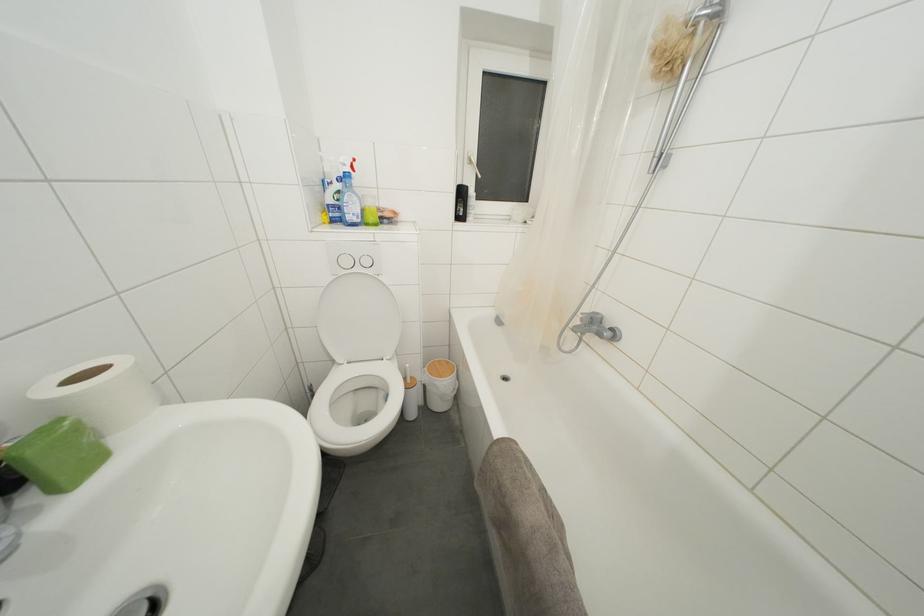
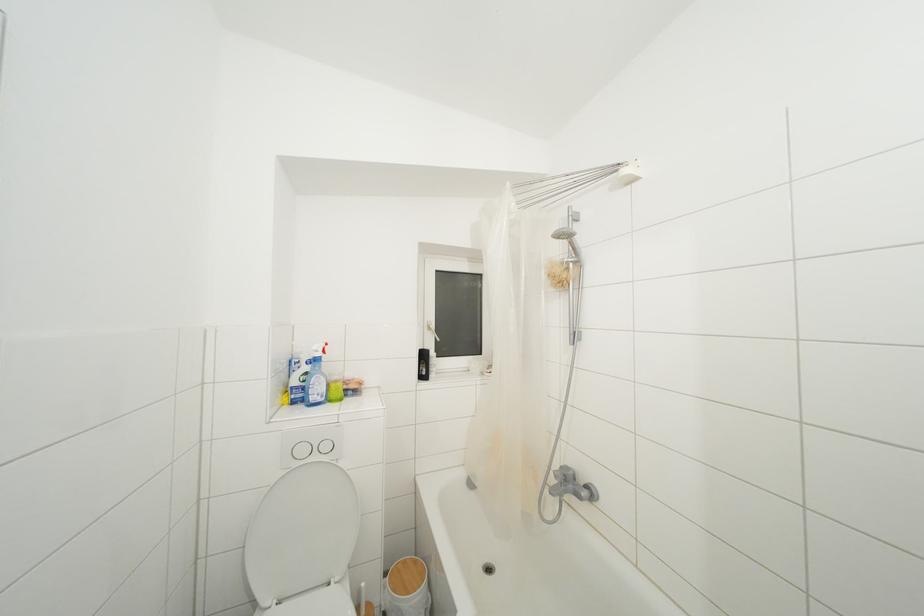
Where in the second image is the point corresponding to the point at 350,267 from the first image?

(307, 456)